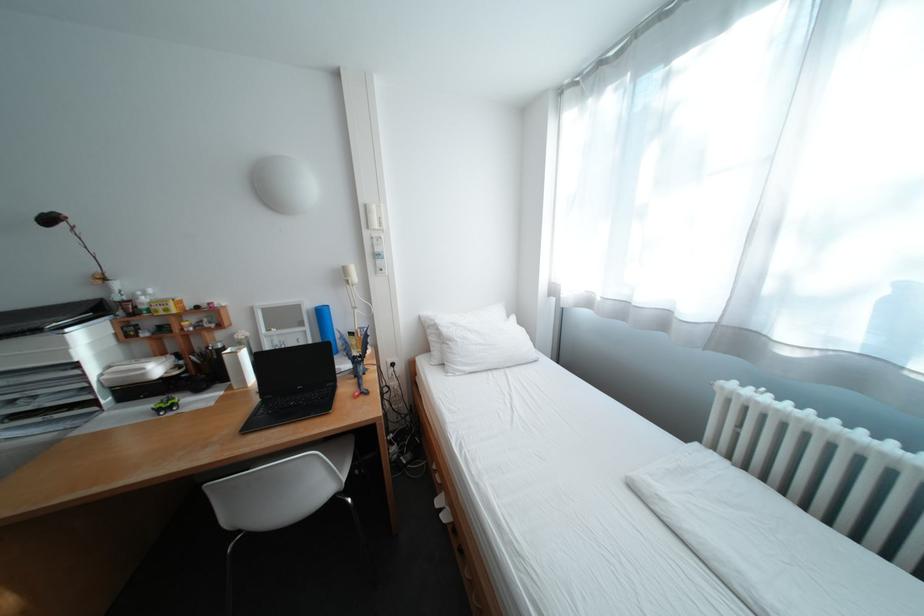
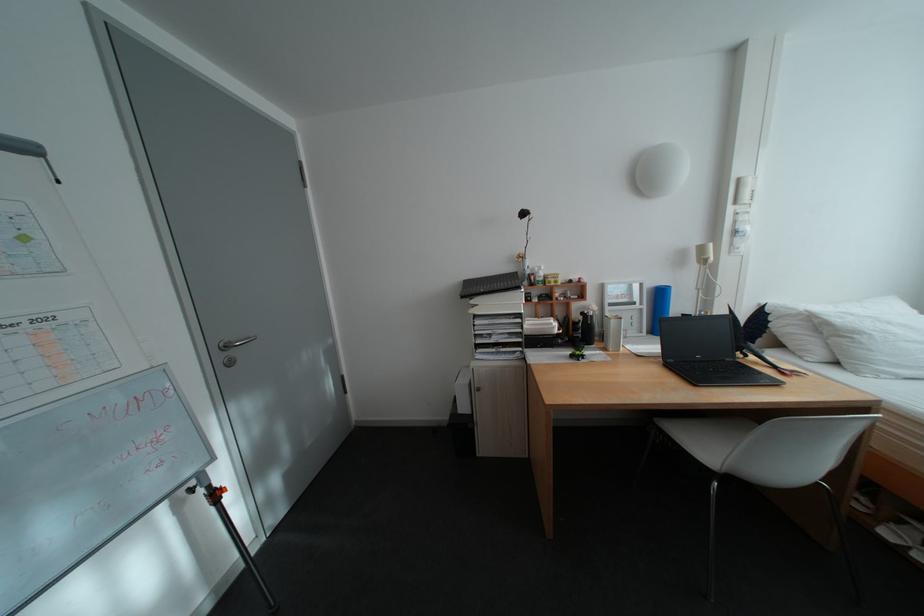
Find the pixel in the second image that matches (320,329) in the first image.

(657, 307)